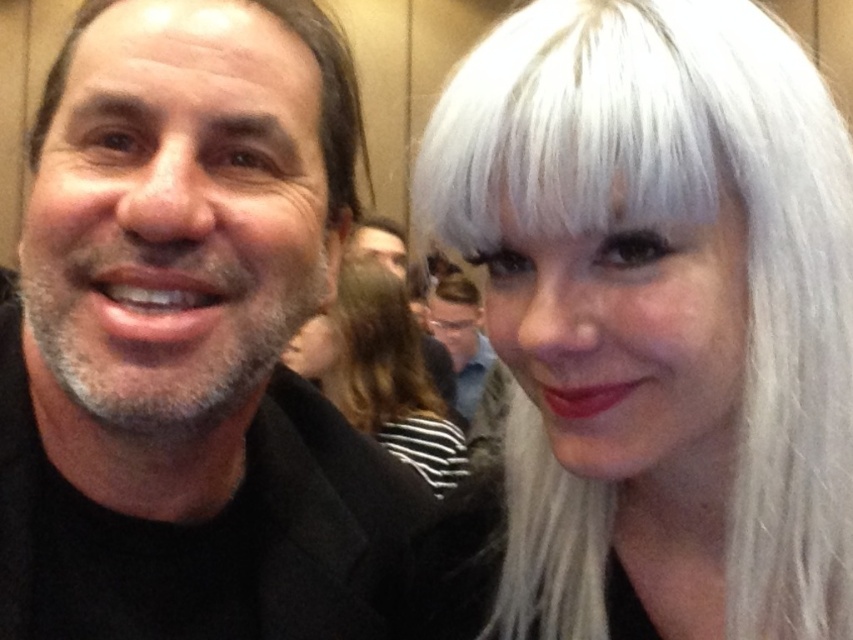
Is white silky hair at right bigger than gray matte hair at left?

Indeed, white silky hair at right has a larger size compared to gray matte hair at left.

Which is above, white silky hair at right or gray matte hair at left?

gray matte hair at left is above.

What do you see at coordinates (688, 224) in the screenshot? I see `white silky hair at right` at bounding box center [688, 224].

Identify the location of white silky hair at right. (688, 224).

Does white silky hair at right have a greater height compared to matte black jacket at center?

Incorrect, white silky hair at right's height is not larger of matte black jacket at center's.

Who is lower down, white silky hair at right or matte black jacket at center?

Positioned lower is matte black jacket at center.

Is point (734, 20) less distant than point (445, 332)?

Yes, point (734, 20) is closer to viewer.

The image size is (853, 640). Identify the location of white silky hair at right. pos(688,224).

This screenshot has width=853, height=640. What do you see at coordinates (329, 99) in the screenshot?
I see `gray matte hair at left` at bounding box center [329, 99].

Is point (310, 22) less distant than point (444, 285)?

Yes.

Where is `gray matte hair at left`? The width and height of the screenshot is (853, 640). gray matte hair at left is located at coordinates (329, 99).